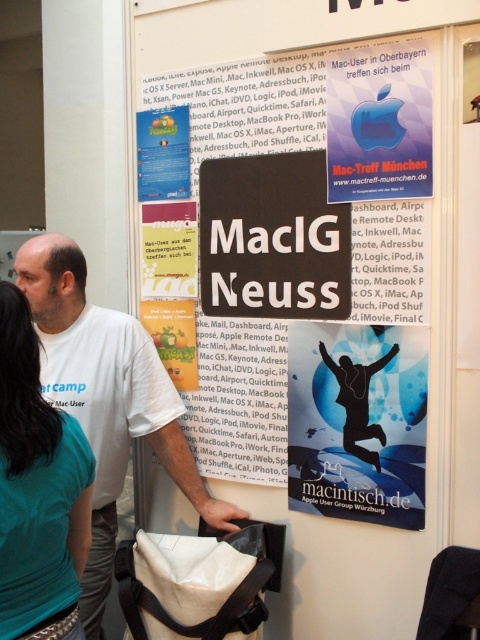
Question: Estimate the real-world distances between objects in this image. Which object is closer to the white t-shirt at center?

Choices:
 (A) teal fabric shirt at upper left
 (B) blue glossy poster at center

Answer: (A)

Question: Among these objects, which one is farthest from the camera?

Choices:
 (A) blue glossy poster at center
 (B) black cardboard sign at center

Answer: (A)

Question: Can you confirm if white t-shirt at center is bigger than teal fabric shirt at upper left?

Choices:
 (A) no
 (B) yes

Answer: (B)

Question: Does black cardboard sign at center come behind white t-shirt at center?

Choices:
 (A) yes
 (B) no

Answer: (B)

Question: Can you confirm if white t-shirt at center is positioned to the left of blue glossy poster at center?

Choices:
 (A) no
 (B) yes

Answer: (B)

Question: Which of the following is the farthest from the observer?

Choices:
 (A) black cardboard sign at center
 (B) teal fabric shirt at upper left
 (C) blue glossy poster at center

Answer: (C)